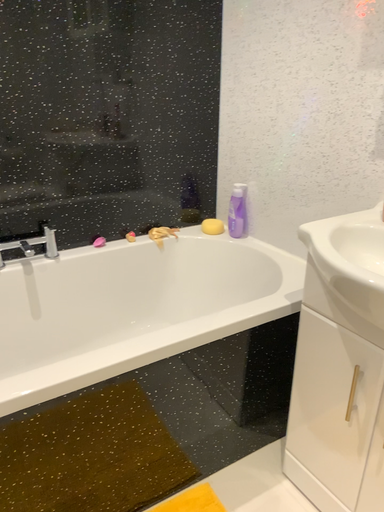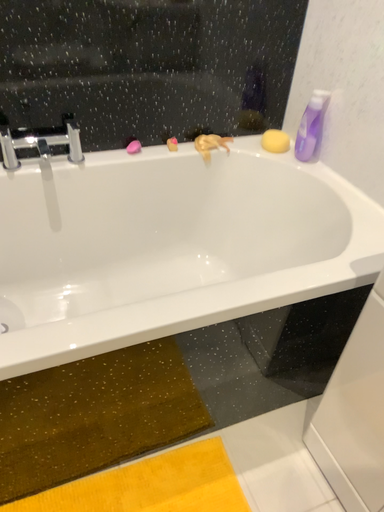
Question: How did the camera likely rotate when shooting the video?

Choices:
 (A) rotated downward
 (B) rotated upward

Answer: (A)